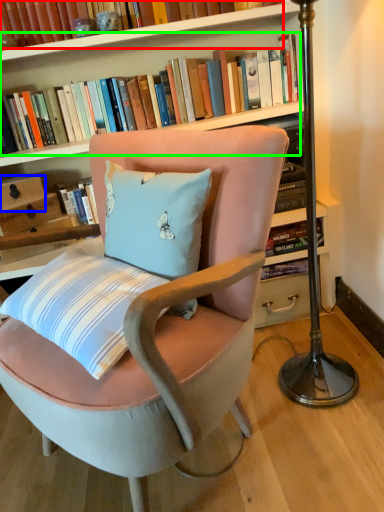
Question: Based on their relative distances, which object is nearer to book (highlighted by a red box)? Choose from drawer (highlighted by a blue box) and book (highlighted by a green box).

Choices:
 (A) drawer
 (B) book

Answer: (B)